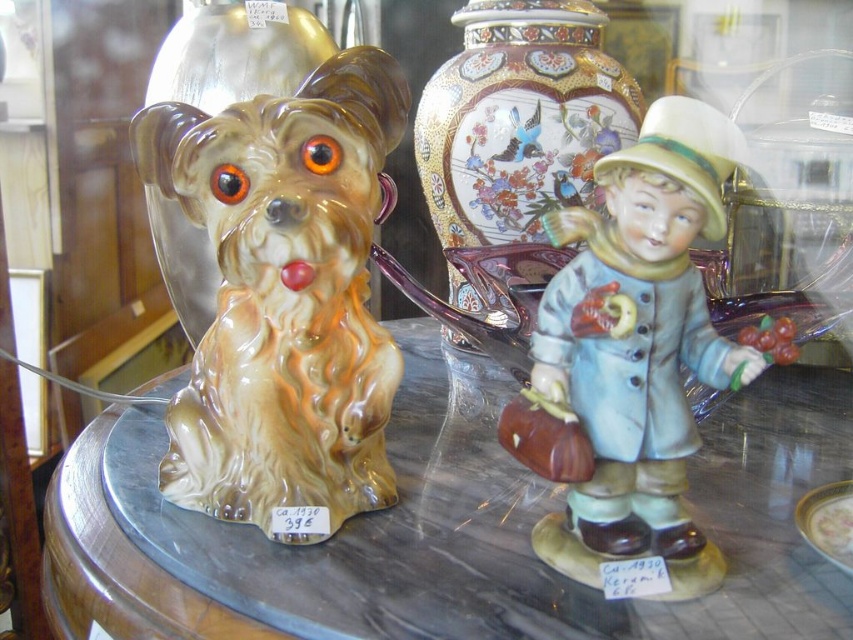
Question: Which of these objects is positioned closest to the porcelain vase with floral design at center?

Choices:
 (A) translucent glass table at center
 (B) shiny gold vase at left
 (C) porcelain boy figurine at center
 (D) matte ceramic dog at left

Answer: (B)

Question: Estimate the real-world distances between objects in this image. Which object is closer to the translucent glass table at center?

Choices:
 (A) shiny gold vase at left
 (B) matte ceramic dog at left

Answer: (B)

Question: Is translucent glass table at center wider than porcelain boy figurine at center?

Choices:
 (A) yes
 (B) no

Answer: (A)

Question: Does matte ceramic dog at left have a lesser width compared to shiny gold vase at left?

Choices:
 (A) yes
 (B) no

Answer: (A)

Question: Does matte ceramic dog at left have a lesser width compared to porcelain vase with floral design at center?

Choices:
 (A) yes
 (B) no

Answer: (A)

Question: Considering the real-world distances, which object is closest to the translucent glass table at center?

Choices:
 (A) matte ceramic dog at left
 (B) shiny gold vase at left
 (C) porcelain vase with floral design at center

Answer: (A)